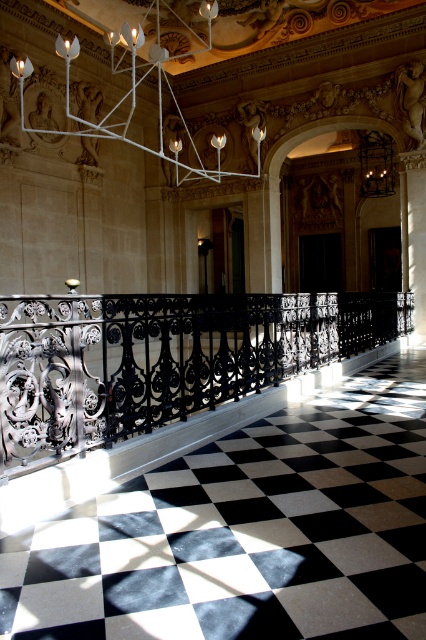
Question: Is black wrought iron railing at center above white metal chandelier at upper center?

Choices:
 (A) yes
 (B) no

Answer: (B)

Question: Does black wrought iron railing at center have a smaller size compared to white metal chandelier at upper center?

Choices:
 (A) yes
 (B) no

Answer: (A)

Question: Does black wrought iron railing at center have a lesser width compared to white metal chandelier at upper center?

Choices:
 (A) no
 (B) yes

Answer: (A)

Question: Among these objects, which one is farthest from the camera?

Choices:
 (A) white metal chandelier at upper center
 (B) black wrought iron railing at center

Answer: (A)

Question: Which of the following is the closest to the observer?

Choices:
 (A) (157, 396)
 (B) (39, 132)

Answer: (A)